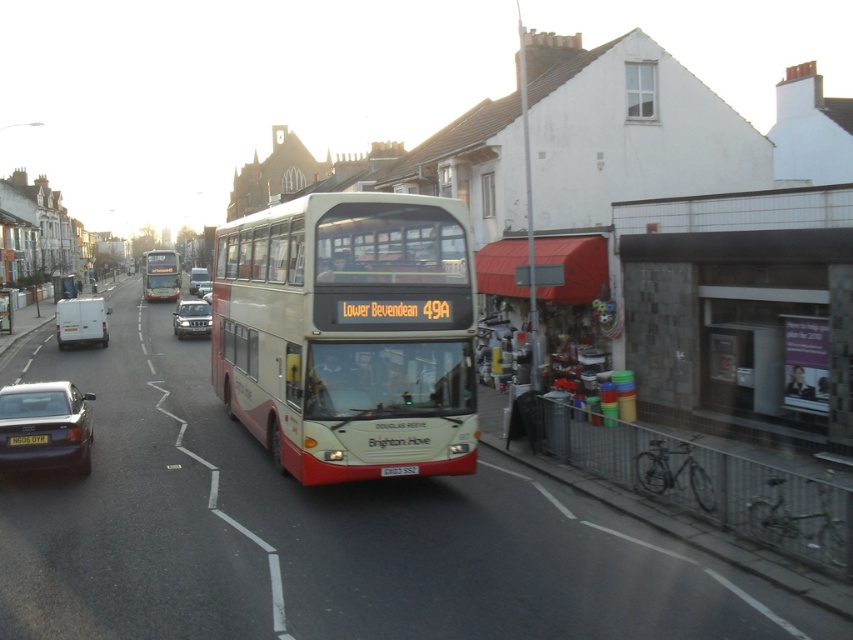
Question: Where is matte red bus at center located in relation to matte black car at lower left in the image?

Choices:
 (A) above
 (B) below

Answer: (A)

Question: Which point appears closest to the camera in this image?

Choices:
 (A) (165, 292)
 (B) (193, 320)
 (C) (76, 307)
 (D) (45, 442)

Answer: (D)

Question: Is white matte van at left below matte white bus at center?

Choices:
 (A) no
 (B) yes

Answer: (B)

Question: Does metallic silver suv at center have a greater width compared to yellow matte license plate at lower center?

Choices:
 (A) no
 (B) yes

Answer: (B)

Question: Considering the real-world distances, which object is farthest from the metallic silver car at center?

Choices:
 (A) matte black car at lower left
 (B) metallic silver suv at center
 (C) silver metallic suv at center

Answer: (A)

Question: Which point is closer to the camera?

Choices:
 (A) matte white bus at center
 (B) yellow matte license plate at lower center

Answer: (B)